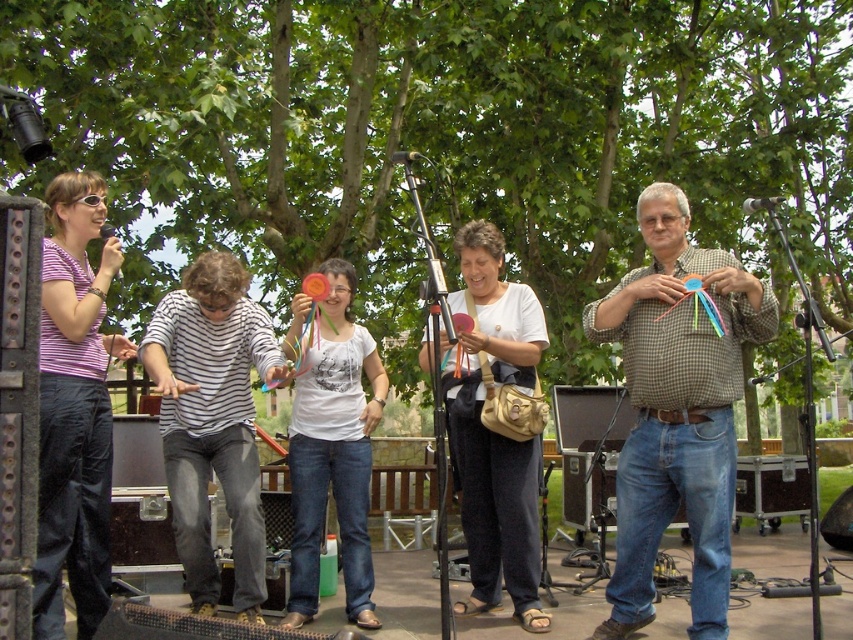
Who is higher up, matte purple shirt at center or white fabric purse at center?

matte purple shirt at center is above.

Looking at this image, is matte purple shirt at center behind white fabric purse at center?

That is False.

Does point (62, 486) lie in front of point (492, 316)?

Yes, point (62, 486) is in front of point (492, 316).

Locate an element on the screen. Image resolution: width=853 pixels, height=640 pixels. matte purple shirt at center is located at coordinates (74, 410).

Is checkered shirt at center to the left of white matte shirt at center from the viewer's perspective?

In fact, checkered shirt at center is to the right of white matte shirt at center.

Can you confirm if checkered shirt at center is positioned below white matte shirt at center?

No, checkered shirt at center is not below white matte shirt at center.

Locate an element on the screen. The height and width of the screenshot is (640, 853). checkered shirt at center is located at coordinates (677, 410).

Between striped shirt at center and white matte shirt at center, which one has less height?

Standing shorter between the two is striped shirt at center.

Based on the photo, who is more forward, [247,572] or [320,352]?

Positioned in front is point [247,572].

Describe the element at coordinates (213, 420) in the screenshot. I see `striped shirt at center` at that location.

You are a GUI agent. You are given a task and a screenshot of the screen. Output one action in this format:
    pyautogui.click(x=<x>, y=<y>)
    Task: Click on the striped shirt at center
    Image resolution: width=853 pixels, height=640 pixels.
    Given the screenshot: What is the action you would take?
    pyautogui.click(x=213, y=420)